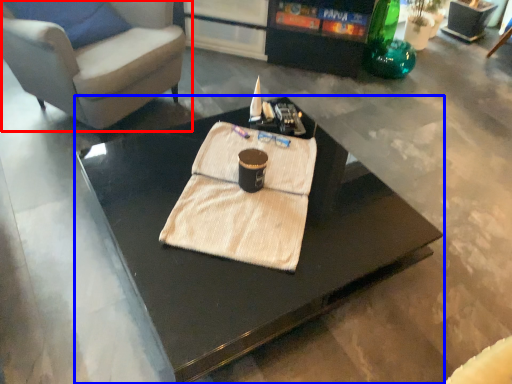
Question: Which point is further to the camera, chair (highlighted by a red box) or coffee table (highlighted by a blue box)?

Choices:
 (A) chair
 (B) coffee table

Answer: (A)